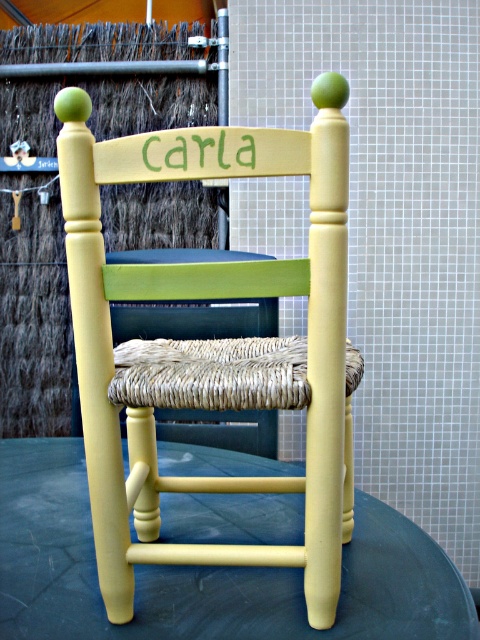
Between matte yellow wood chair at center and yellow painted wood round table at center, which one has more height?

matte yellow wood chair at center

Is matte yellow wood chair at center to the right of yellow painted wood round table at center from the viewer's perspective?

Indeed, matte yellow wood chair at center is positioned on the right side of yellow painted wood round table at center.

You are a GUI agent. You are given a task and a screenshot of the screen. Output one action in this format:
    pyautogui.click(x=<x>, y=<y>)
    Task: Click on the matte yellow wood chair at center
    
    Given the screenshot: What is the action you would take?
    pyautogui.click(x=212, y=342)

Find the location of a particular element. matte yellow wood chair at center is located at coordinates (212, 342).